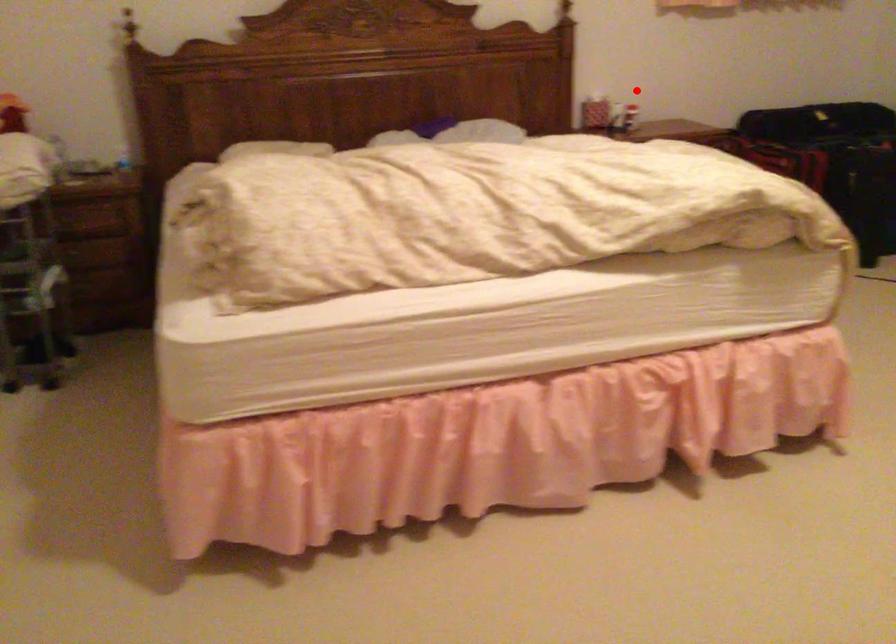
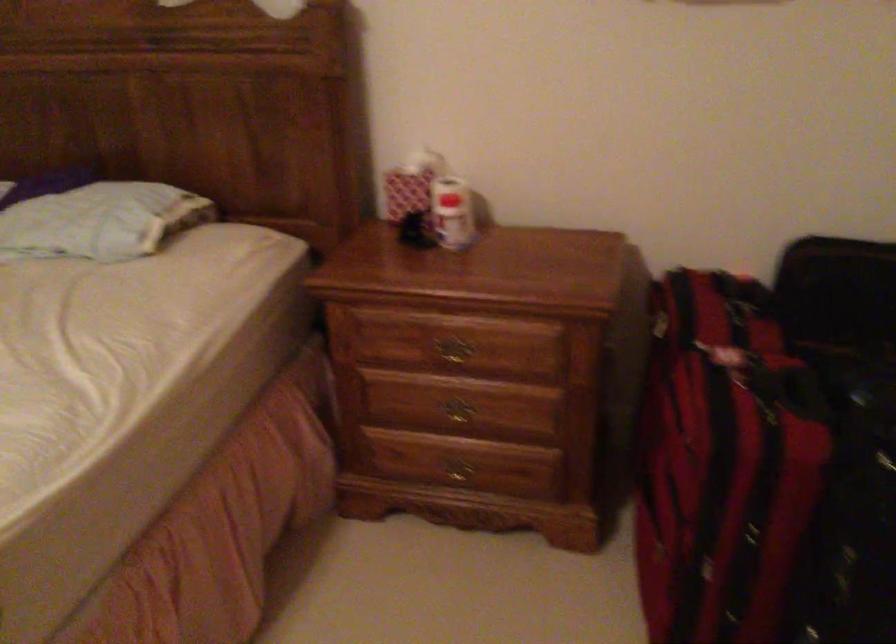
Where in the second image is the point corresponding to the highlighted location from the first image?

(452, 213)